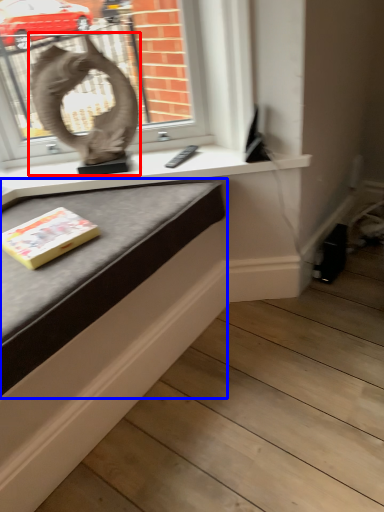
Question: Which object appears closest to the camera in this image, sculpture (highlighted by a red box) or table (highlighted by a blue box)?

Choices:
 (A) sculpture
 (B) table

Answer: (B)